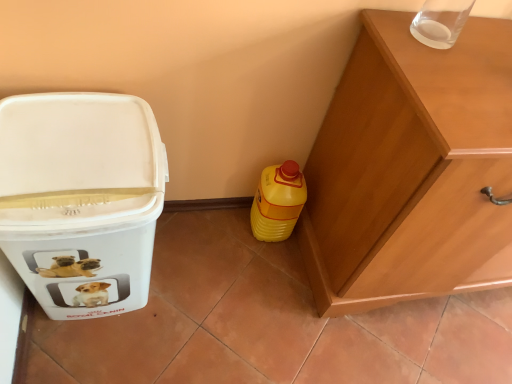
Question: From the image's perspective, is yellow plastic bottle at lower right above white plastic container at left?

Choices:
 (A) no
 (B) yes

Answer: (B)

Question: Is white plastic container at left at the back of yellow plastic bottle at lower right?

Choices:
 (A) yes
 (B) no

Answer: (B)

Question: From the image's perspective, is yellow plastic bottle at lower right below white plastic container at left?

Choices:
 (A) yes
 (B) no

Answer: (B)

Question: Is yellow plastic bottle at lower right to the left of white plastic container at left from the viewer's perspective?

Choices:
 (A) no
 (B) yes

Answer: (A)

Question: Considering the relative sizes of yellow plastic bottle at lower right and white plastic container at left in the image provided, is yellow plastic bottle at lower right smaller than white plastic container at left?

Choices:
 (A) yes
 (B) no

Answer: (A)

Question: In the image, is white plastic container at left positioned in front of or behind wooden cabinet at right?

Choices:
 (A) front
 (B) behind

Answer: (A)

Question: From the image's perspective, is white plastic container at left above or below wooden cabinet at right?

Choices:
 (A) below
 (B) above

Answer: (A)

Question: Is white plastic container at left wider or thinner than wooden cabinet at right?

Choices:
 (A) thin
 (B) wide

Answer: (A)

Question: Is point (137, 192) positioned closer to the camera than point (424, 74)?

Choices:
 (A) closer
 (B) farther

Answer: (A)

Question: Is point (334, 221) closer or farther from the camera than point (256, 231)?

Choices:
 (A) farther
 (B) closer

Answer: (B)

Question: From their relative heights in the image, would you say wooden cabinet at right is taller or shorter than yellow plastic bottle at lower right?

Choices:
 (A) tall
 (B) short

Answer: (A)

Question: Looking at their shapes, would you say wooden cabinet at right is wider or thinner than yellow plastic bottle at lower right?

Choices:
 (A) thin
 (B) wide

Answer: (B)

Question: From a real-world perspective, is wooden cabinet at right positioned above or below yellow plastic bottle at lower right?

Choices:
 (A) below
 (B) above

Answer: (B)

Question: From a real-world perspective, is wooden cabinet at right positioned above or below white plastic container at left?

Choices:
 (A) above
 (B) below

Answer: (A)

Question: Is wooden cabinet at right in front of or behind white plastic container at left in the image?

Choices:
 (A) behind
 (B) front

Answer: (A)